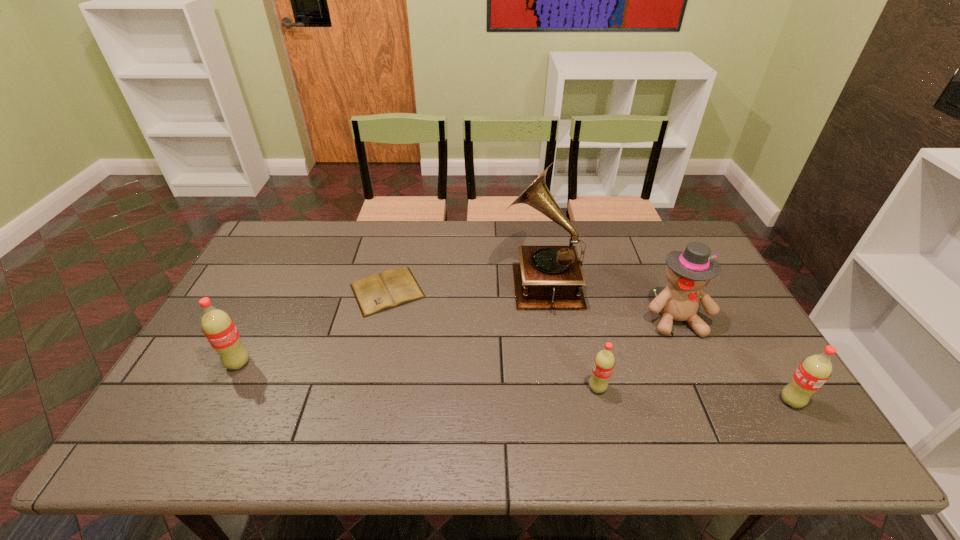
The height and width of the screenshot is (540, 960). I want to click on the leftmost object, so click(218, 327).

Find the location of a particular element. Image resolution: width=960 pixels, height=540 pixels. the fourth farthest object is located at coordinates (218, 327).

You are a GUI agent. You are given a task and a screenshot of the screen. Output one action in this format:
    pyautogui.click(x=<x>, y=<y>)
    Task: Click on the shortest soda
    
    Given the screenshot: What is the action you would take?
    pyautogui.click(x=604, y=361)

Find the location of `the second shortest object`. the second shortest object is located at coordinates (604, 361).

Locate an element on the screen. the rightmost object is located at coordinates (815, 370).

Identify the location of the rightmost soda. (815, 370).

Where is `record player`? Image resolution: width=960 pixels, height=540 pixels. record player is located at coordinates (548, 277).

This screenshot has width=960, height=540. Find the location of `the fifth object from right to left`. the fifth object from right to left is located at coordinates (377, 292).

Locate an element on the screen. The height and width of the screenshot is (540, 960). the shortest object is located at coordinates coord(377,292).

I want to click on rag_doll, so click(688, 272).